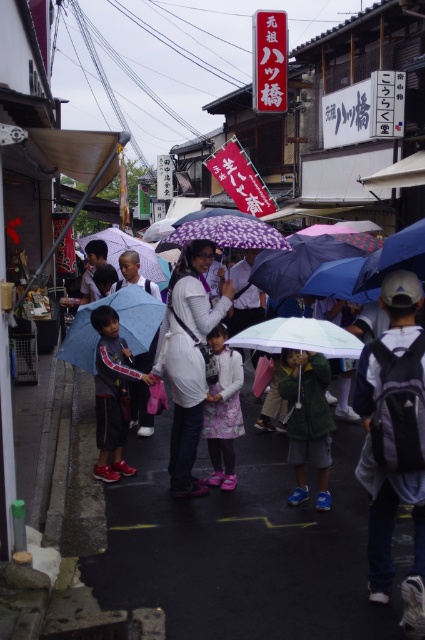
You are a delivery person carrying a box that is 2 feet wide. You need to pass between the purple matte umbrella at center and the matte white jacket at center. Can you fit through the space between them?

The distance between the purple matte umbrella at center and the matte white jacket at center is 23.46 inches, which is approximately 1.95 feet. Since your box is 2 feet wide, it might be too wide to fit through the space comfortably. You may need to find another path or adjust your position to ensure the box doesn not get stuck.

You are standing at the camera position and want to take a photo of the point at coordinates point (393, 243). If your camera has a maximum focus range of 4 meters, will you be able to focus on the point?

The distance of point (393, 243) from camera is 4.59 meters, so the camera cannot focus on it since it exceeds the maximum focus range of 4 meters.

You are a street vendor who wants to place a small sign between the gray fabric backpack at center and the floral fabric dress at center so that it is visible to both people carrying them. Given that the sign is 10 cm tall, will its height be sufficient for both to see it without bending down?

The gray fabric backpack at center is much taller than the floral fabric dress at center. Since the sign is only 10 cm tall, it may not be visible to the person carrying the taller gray fabric backpack at center without bending down, but it would be visible to the person with the shorter floral fabric dress at center.